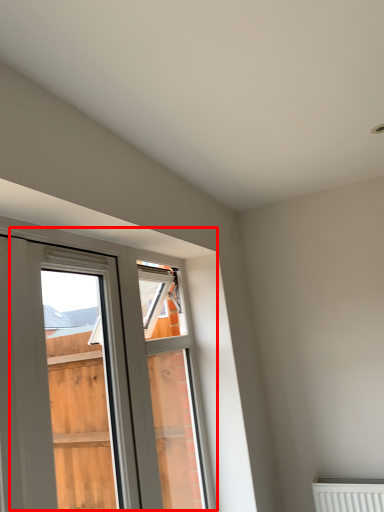
Question: Considering the relative positions of window (annotated by the red box) and window frame in the image provided, where is window (annotated by the red box) located with respect to the staircase?

Choices:
 (A) right
 (B) left

Answer: (B)